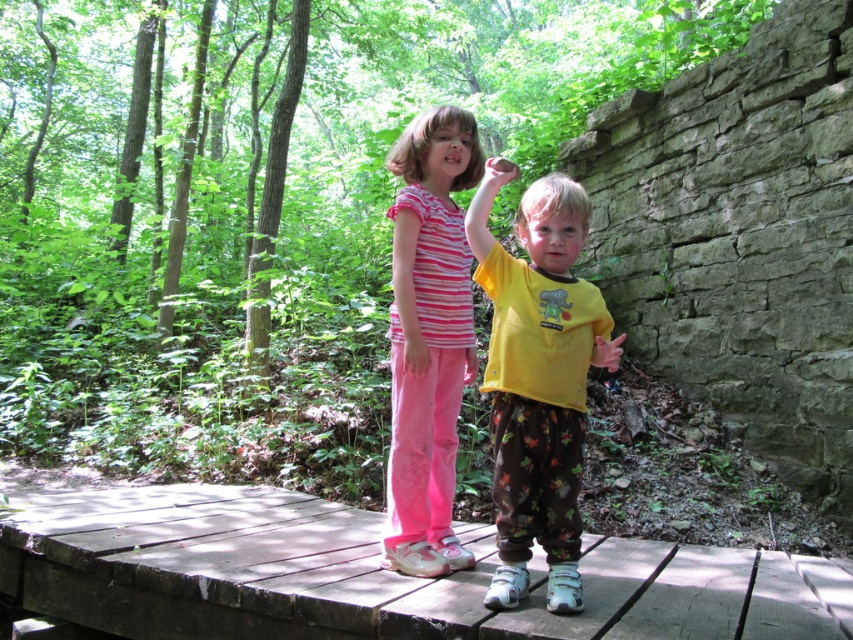
You are a photographer trying to capture a photo of two children on a wooden bridge in a forest. You notice two points marked in the scene. The first point is at coordinates point (177, 625) and the second is at point (436, 372). Which of these two points is closer to you as the photographer?

Point (177, 625) is closer to the viewer than point (436, 372).

You are a painter who wants to paint the wooden planks at center and the yellow matte shirt at center. Which object should you use a wider brush for?

The wooden planks at center are wider than the yellow matte shirt at center, so you should use a wider brush for the wooden planks at center.

You are a photographer standing on the wooden bridge. You want to take a photo of the wooden planks at center and the yellow matte shirt at center so that both are clearly visible. Which object should you focus on first to ensure proper focus?

The wooden planks at center is shorter than yellow matte shirt at center, so you should focus on the yellow matte shirt at center first to ensure both are in focus since it is taller and might be further away.